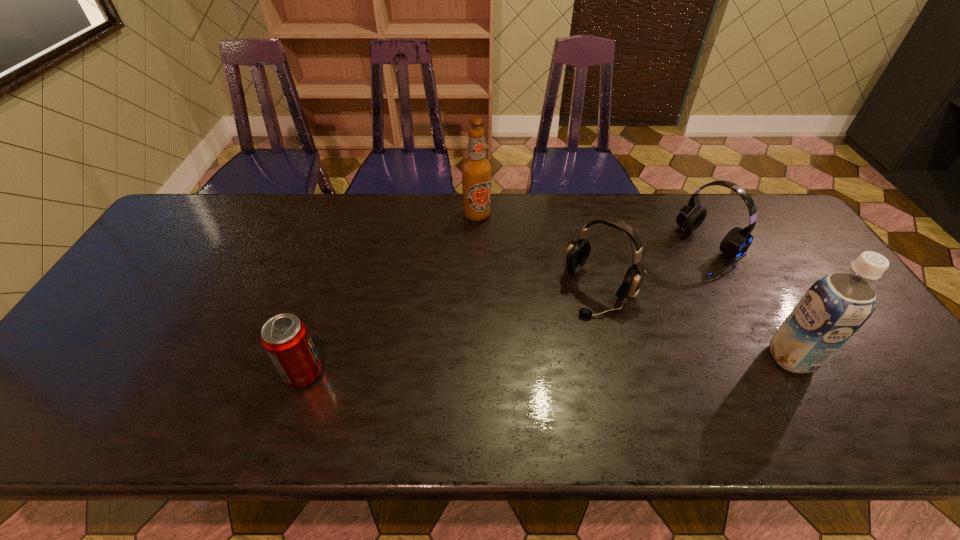
At what (x,y) coordinates should I click in order to perform the action: click on vacant space on the desktop that is between the shortest object and the soya milk and is positioned on the ear cushions of the right headset. Please return your answer as a coordinate pair (x, y). Looking at the image, I should click on (541, 365).

Identify the location of vacant space on the desktop that is between the leftmost object and the soya milk and is positioned on the front label of the fourth object from right to left. The width and height of the screenshot is (960, 540). (522, 366).

This screenshot has height=540, width=960. What are the coordinates of `free space on the desktop that is between the shortest object and the soya milk and is positioned with the microphone on the side of the third object from left to right` in the screenshot? It's located at (540, 366).